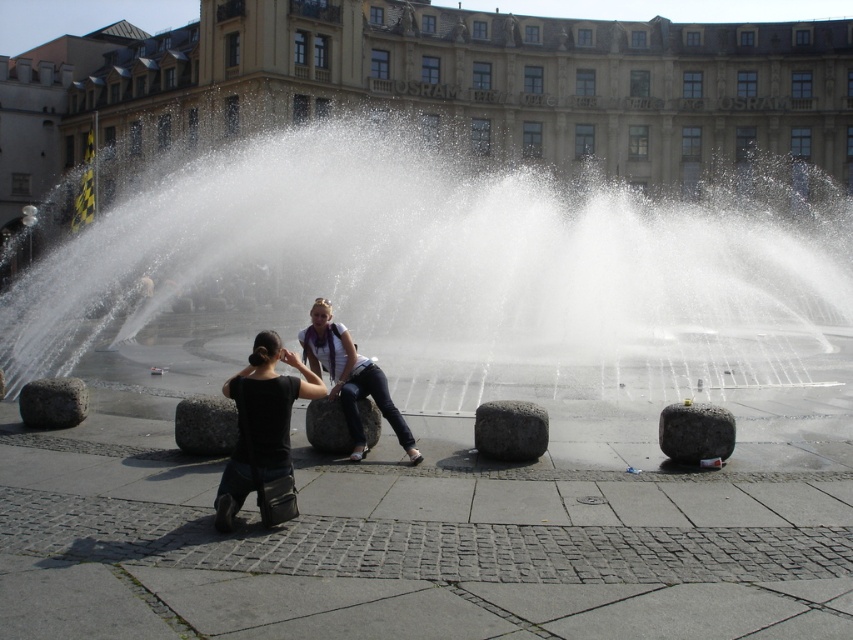
You are a photographer standing at the edge of the fountain. You want to take a photo of both the granite stone at lower right and the gray stone at center in the same frame. Which stone should you position closer to the camera to ensure both are visible without zooming?

The granite stone at lower right is already closer to the viewer than the gray stone at center, so positioning yourself to include both in the frame without zooming would naturally capture the granite stone at lower right closer to the camera and the gray stone at center further back.

You are standing at point (x=361, y=440) and want to walk to point (x=668, y=406). Is the destination point behind you or in front of you?

The destination point (x=668, y=406) is behind you because it is located behind point (x=361, y=440) where you are standing.